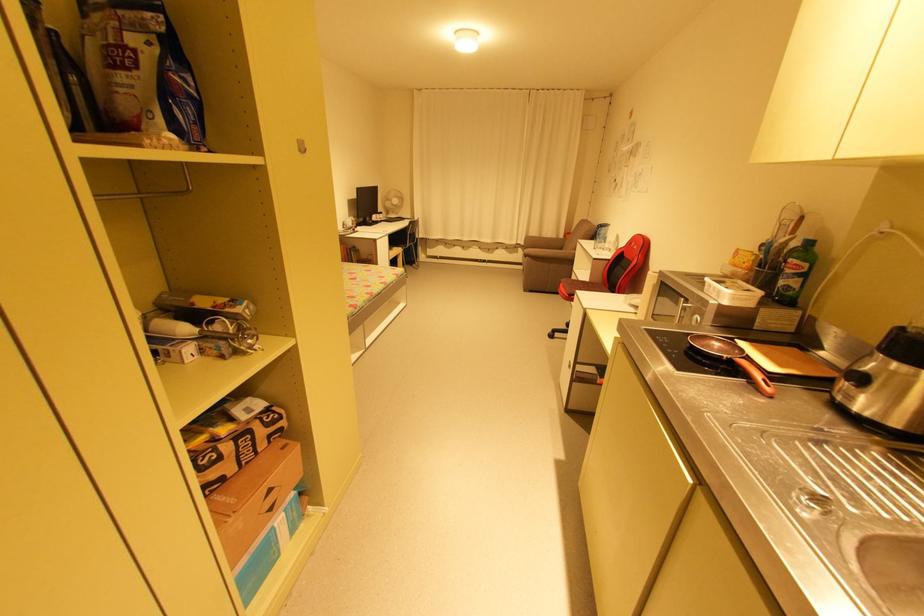
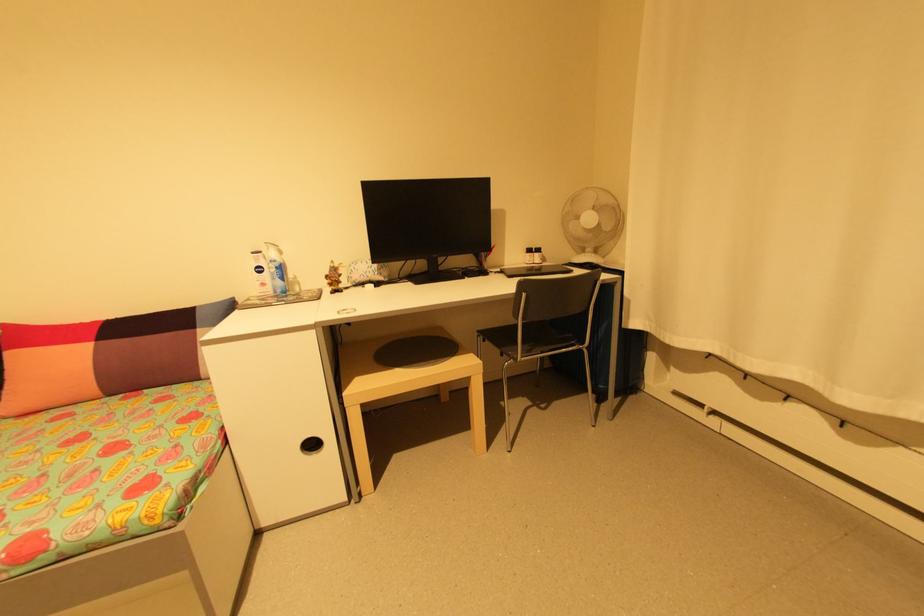
Locate, in the second image, the point that corresponds to point 385,215 in the first image.

(541, 254)